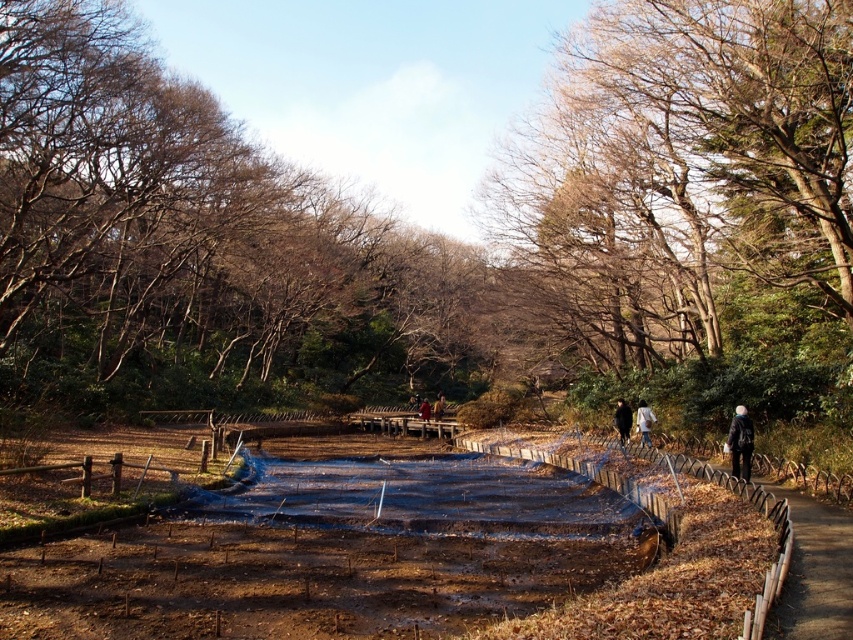
Question: Among these objects, which one is nearest to the camera?

Choices:
 (A) dark gray fabric jacket at lower right
 (B) dark brown wooden bench at center
 (C) black matte jacket at center-right
 (D) brown leafless branches at upper center

Answer: (A)

Question: Does yellow fabric bag at center appear on the left side of dark brown wooden bench at center?

Choices:
 (A) yes
 (B) no

Answer: (B)

Question: Can you confirm if transparent plastic puddle at center is positioned below dark gray fabric jacket at lower right?

Choices:
 (A) no
 (B) yes

Answer: (B)

Question: Which object appears farthest from the camera in this image?

Choices:
 (A) dark brown wooden bench at center
 (B) yellow fabric bag at center
 (C) light brown fabric jacket at center

Answer: (B)

Question: Which point appears closest to the camera in this image?

Choices:
 (A) (750, 452)
 (B) (434, 404)

Answer: (A)

Question: Can you confirm if brown leafless branches at upper center is positioned below light brown fabric jacket at center?

Choices:
 (A) yes
 (B) no

Answer: (B)